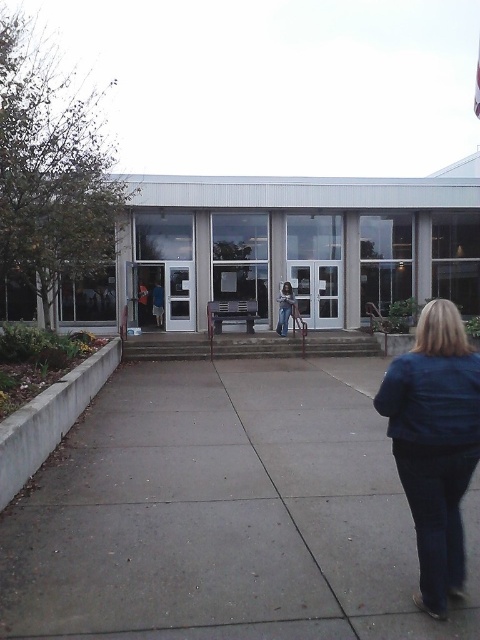
You are standing at the entrance of the modern building and want to take a photo of the point at coordinates point (424, 604). If your camera has a focal length of 50mm and you are 3.57 meters away from the point, what is the required distance in millimeters between the lens and the image sensor to focus properly?

The required distance between the lens and the image sensor to focus properly is calculated using the lens formula 1 focal length equals 1 object distance plus 1 image distance. However, since the focal length is given as 50mm and the object distance is 3570mm, the image distance would be approximately 50.14mm. Therefore, the lens should be positioned about 50.14 millimeters away from the image sensor.

Based on the photo, you are a delivery person trying to reach the entrance of the building. You are currently standing on the gray concrete pavement at center. Which direction should you move to approach the clear glass storefront at center?

The gray concrete pavement at center is in front of the clear glass storefront at center, so you should move forward towards the clear glass storefront at center to approach it.

You are a delivery person carrying a large package and need to place it on the surface closest to the entrance. Which object between the gray concrete pavement at center and the clear glass storefront at center should you choose?

The gray concrete pavement at center is located below the clear glass storefront at center, so it is closer to the entrance. Therefore, you should place the package on the gray concrete pavement at center.